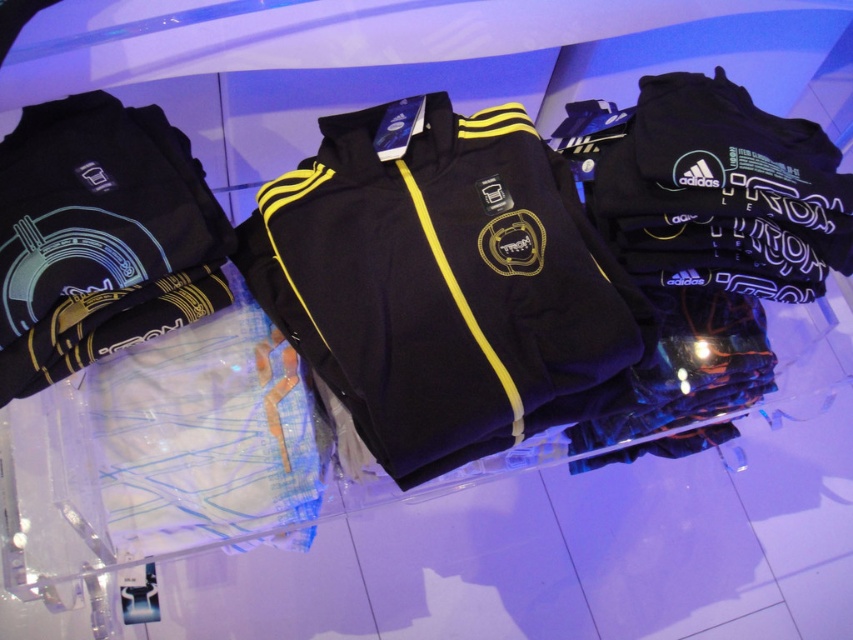
Does matte black jacket at center lie behind glowing blue fabric at left?

Yes.

From the picture: Is matte black jacket at center below glowing blue fabric at left?

Yes.

The height and width of the screenshot is (640, 853). Describe the element at coordinates (440, 282) in the screenshot. I see `matte black jacket at center` at that location.

This screenshot has width=853, height=640. I want to click on matte black jacket at center, so click(440, 282).

Can you confirm if glowing blue fabric at left is thinner than matte black track pants at center?

Yes.

Is point (143, 136) closer to viewer compared to point (279, 390)?

Yes.

At what (x,y) coordinates should I click in order to perform the action: click on glowing blue fabric at left. Please return your answer as a coordinate pair (x, y). Image resolution: width=853 pixels, height=640 pixels. Looking at the image, I should click on (99, 237).

Can you confirm if matte black jacket at center is positioned below matte black track pants at center?

Incorrect, matte black jacket at center is not positioned below matte black track pants at center.

Based on the photo, which of these two, matte black jacket at center or matte black track pants at center, stands taller?

Standing taller between the two is matte black jacket at center.

At what (x,y) coordinates should I click in order to perform the action: click on matte black jacket at center. Please return your answer as a coordinate pair (x, y). Looking at the image, I should click on point(440,282).